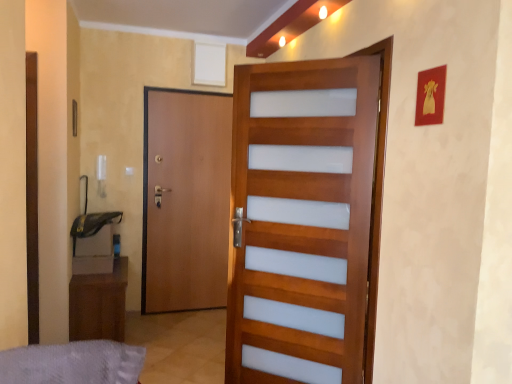
Question: From a real-world perspective, is gray fabric bed at lower left over brown wood door at left, which is the 1th door from back to front?

Choices:
 (A) yes
 (B) no

Answer: (B)

Question: Is gray fabric bed at lower left positioned behind brown wood door at left, placed as the 2th door when sorted from right to left?

Choices:
 (A) yes
 (B) no

Answer: (B)

Question: Is brown wood door at left, which is the 1th door from back to front, inside gray fabric bed at lower left?

Choices:
 (A) no
 (B) yes

Answer: (A)

Question: From the image's perspective, is gray fabric bed at lower left on top of brown wood door at left, which is the 2th door from front to back?

Choices:
 (A) no
 (B) yes

Answer: (A)

Question: Is gray fabric bed at lower left far from brown wood door at left, placed as the 2th door when sorted from right to left?

Choices:
 (A) no
 (B) yes

Answer: (B)

Question: From a real-world perspective, relative to brown wood cabinet at lower left, is wooden door with frosted panels at center, which is the second door from left to right, vertically above or below?

Choices:
 (A) below
 (B) above

Answer: (B)

Question: Looking at their shapes, would you say wooden door with frosted panels at center, acting as the 1th door starting from the right, is wider or thinner than brown wood cabinet at lower left?

Choices:
 (A) wide
 (B) thin

Answer: (B)

Question: In the image, is wooden door with frosted panels at center, which is the second door from left to right, on the left side or the right side of brown wood cabinet at lower left?

Choices:
 (A) right
 (B) left

Answer: (A)

Question: From the image's perspective, is wooden door with frosted panels at center, acting as the 1th door starting from the right, positioned above or below brown wood cabinet at lower left?

Choices:
 (A) below
 (B) above

Answer: (B)

Question: Relative to brown wood cabinet at lower left, is brown wood door at left, which is the 1th door from back to front, in front or behind?

Choices:
 (A) front
 (B) behind

Answer: (B)

Question: Is point (182, 205) positioned closer to the camera than point (126, 266)?

Choices:
 (A) closer
 (B) farther

Answer: (B)

Question: From a real-world perspective, is brown wood door at left, which ranks as the first door in left-to-right order, above or below brown wood cabinet at lower left?

Choices:
 (A) above
 (B) below

Answer: (A)

Question: From the image's perspective, is brown wood door at left, which is the 1th door from back to front, positioned above or below brown wood cabinet at lower left?

Choices:
 (A) above
 (B) below

Answer: (A)

Question: From a real-world perspective, relative to brown wood door at left, placed as the 2th door when sorted from right to left, is wooden door with frosted panels at center, which appears as the second door when viewed from the back, vertically above or below?

Choices:
 (A) above
 (B) below

Answer: (A)

Question: Would you say wooden door with frosted panels at center, which appears as the second door when viewed from the back, is to the left or to the right of brown wood door at left, which ranks as the first door in left-to-right order, in the picture?

Choices:
 (A) right
 (B) left

Answer: (A)